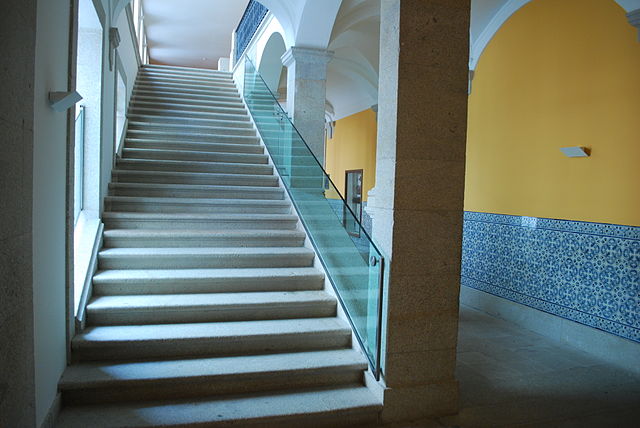
Identify the location of window in the hallway. (352, 193).